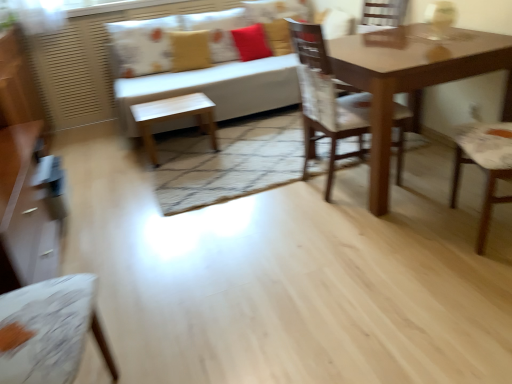
The image size is (512, 384). What are the coordinates of `vacant area to the right of light wood/finely finished table at center` in the screenshot? It's located at (240, 141).